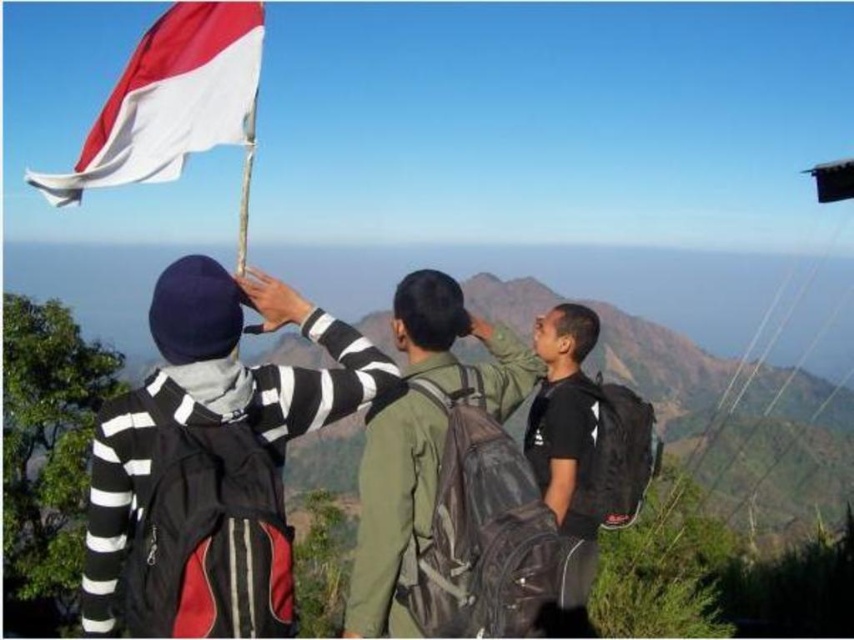
Question: Which point is closer to the camera taking this photo?

Choices:
 (A) (594, 392)
 (B) (194, 406)
 (C) (94, 140)

Answer: (B)

Question: Which is nearer to the black matte backpack at center?

Choices:
 (A) red-white fabric flag at upper left
 (B) green matte jacket at center
 (C) striped fabric sweater at left

Answer: (B)

Question: Can you confirm if striped fabric sweater at left is positioned to the right of red-white fabric flag at upper left?

Choices:
 (A) no
 (B) yes

Answer: (B)

Question: Does striped fabric sweater at left appear on the left side of black matte backpack at center?

Choices:
 (A) yes
 (B) no

Answer: (A)

Question: Which object is the farthest from the black matte backpack at center?

Choices:
 (A) red-white fabric flag at upper left
 (B) striped fabric sweater at left

Answer: (A)

Question: Does striped fabric sweater at left appear over red-white fabric flag at upper left?

Choices:
 (A) yes
 (B) no

Answer: (B)